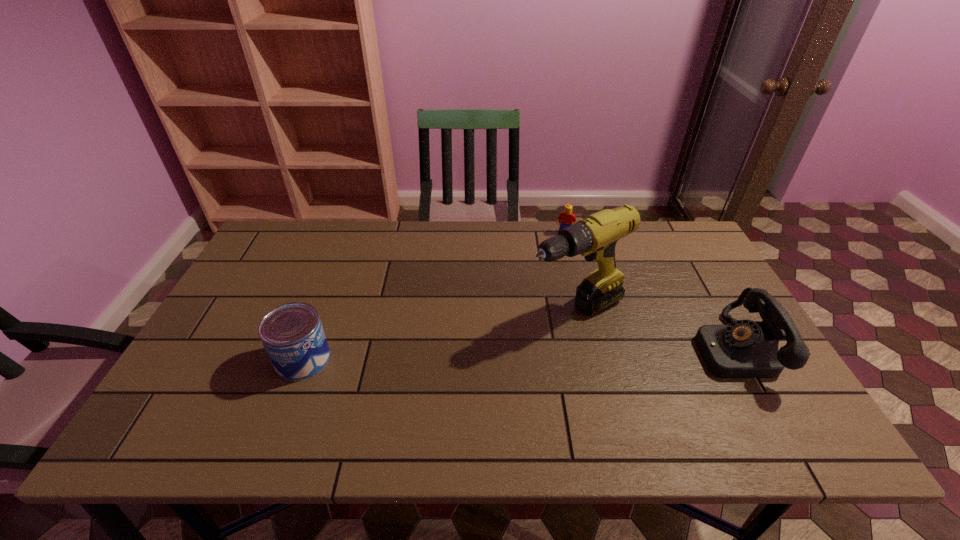
Locate an element on the screen. The width and height of the screenshot is (960, 540). free space located on the handle side of the tallest object is located at coordinates (519, 333).

In order to click on free spot located on the handle side of the tallest object in this screenshot , I will do `click(425, 381)`.

Locate an element on the screen. This screenshot has width=960, height=540. free spot located on the handle side of the tallest object is located at coordinates [440, 373].

The height and width of the screenshot is (540, 960). Find the location of `vacant position located on the face of the Lego`. vacant position located on the face of the Lego is located at coordinates (540, 309).

I want to click on vacant point located on the face of the Lego, so click(547, 286).

This screenshot has width=960, height=540. Find the location of `free space located on the face of the Lego`. free space located on the face of the Lego is located at coordinates (540, 309).

Find the location of a particular element. The width and height of the screenshot is (960, 540). object present at the far edge is located at coordinates (565, 219).

Where is `can situated at the near edge`? The height and width of the screenshot is (540, 960). can situated at the near edge is located at coordinates click(x=292, y=334).

Find the location of a particular element. telephone that is positioned at the near edge is located at coordinates [x=744, y=349].

In order to click on object located at the right edge in this screenshot , I will do `click(744, 349)`.